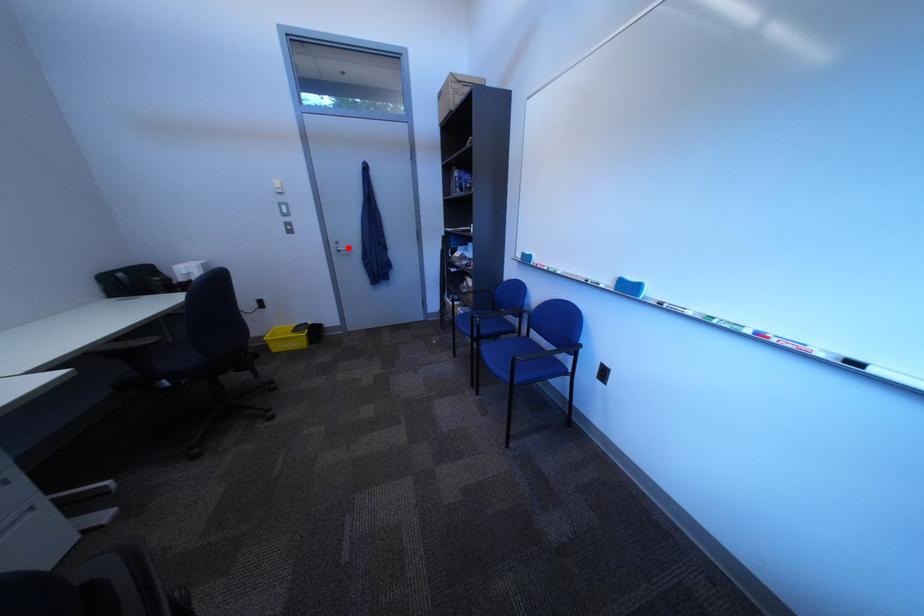
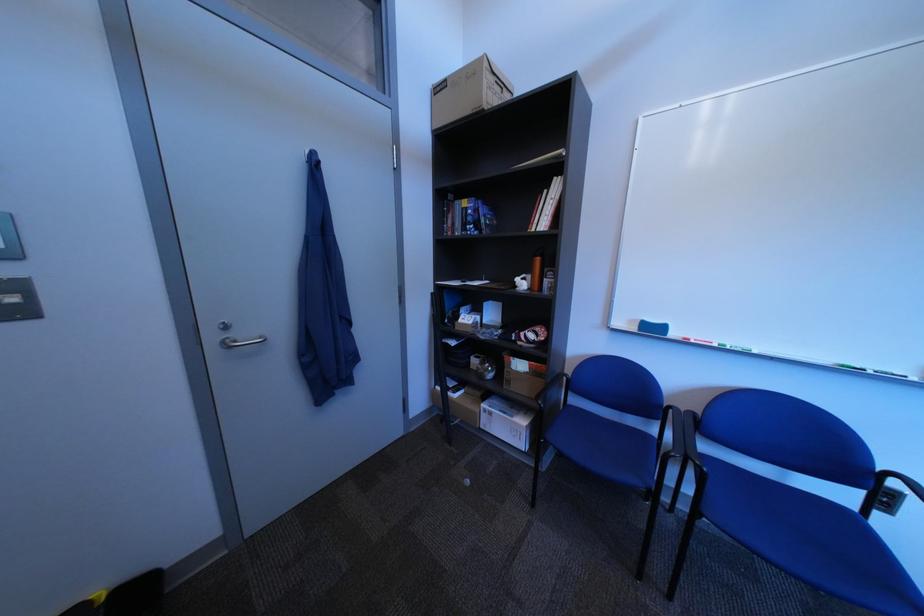
Where in the second image is the point corresponding to the highlighted location from the first image?

(226, 339)